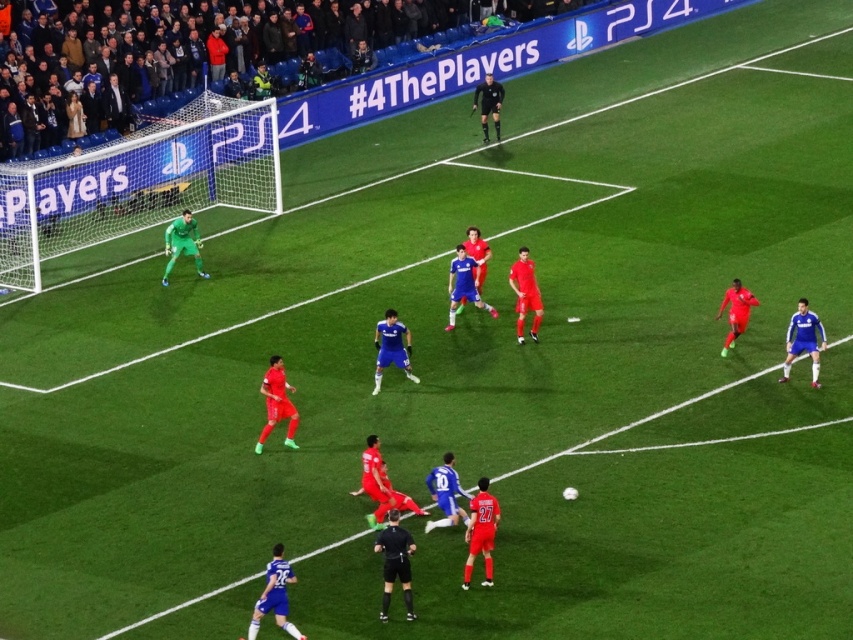
Question: Is shiny red jersey at center wider than green matte jersey at left?

Choices:
 (A) yes
 (B) no

Answer: (B)

Question: Is dark blue fabric crowd at upper left wider than blue jersey player at center?

Choices:
 (A) no
 (B) yes

Answer: (B)

Question: Which object is the closest to the blue matte jersey at center?

Choices:
 (A) shiny red jersey at center
 (B) blue jersey player at center
 (C) dark blue fabric crowd at upper left
 (D) green matte jersey at left

Answer: (A)

Question: Does dark blue fabric crowd at upper left come in front of shiny red jersey at center?

Choices:
 (A) no
 (B) yes

Answer: (A)

Question: Which of the following is the farthest from the observer?

Choices:
 (A) (62, 244)
 (B) (498, 99)
 (C) (273, 412)
 (D) (740, 381)

Answer: (B)

Question: Estimate the real-world distances between objects in this image. Which object is farther from the white net at left?

Choices:
 (A) green matte jersey at left
 (B) shiny red jersey at center
 (C) black matte referee at center

Answer: (B)